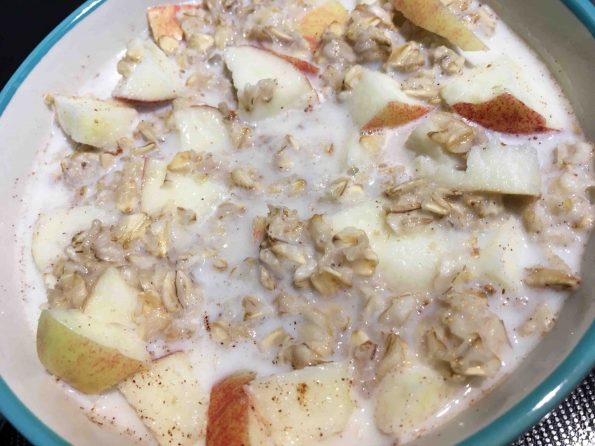
Where is `bowl`? bowl is located at coordinates (93, 64).